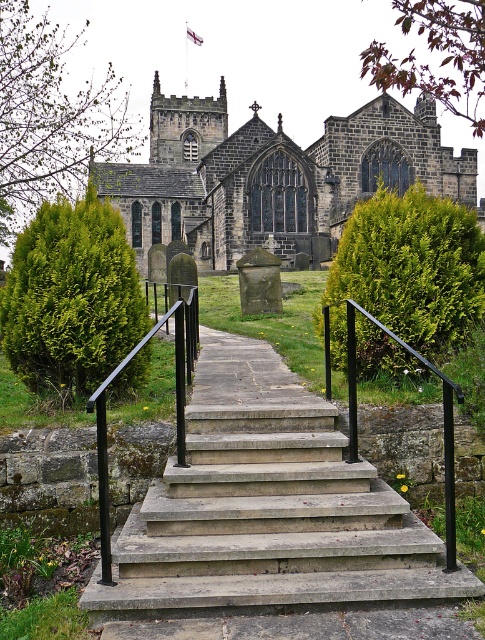
You are standing at the bottom of the stone staircase in the churchyard. You want to walk up the steps to the church entrance. Which object will you encounter first as you climb the steps? The dark gray stone church at center or the black metal handrail at center?

You will encounter the black metal handrail at center first because it is positioned behind the dark gray stone church at center, meaning the handrail is closer to you at the base of the steps.